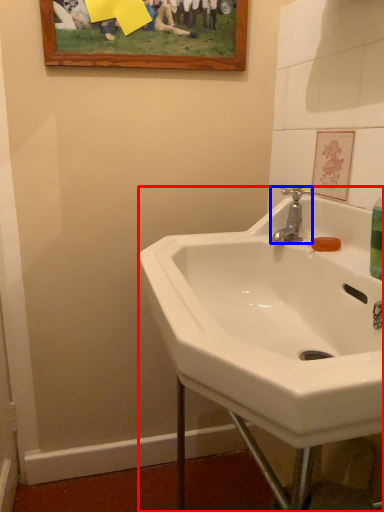
Question: Which of the following is the farthest to the observer, sink (highlighted by a red box) or tap (highlighted by a blue box)?

Choices:
 (A) sink
 (B) tap

Answer: (B)